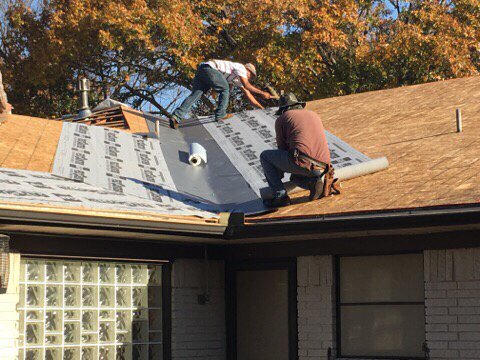
The width and height of the screenshot is (480, 360). I want to click on door frame, so click(288, 262).